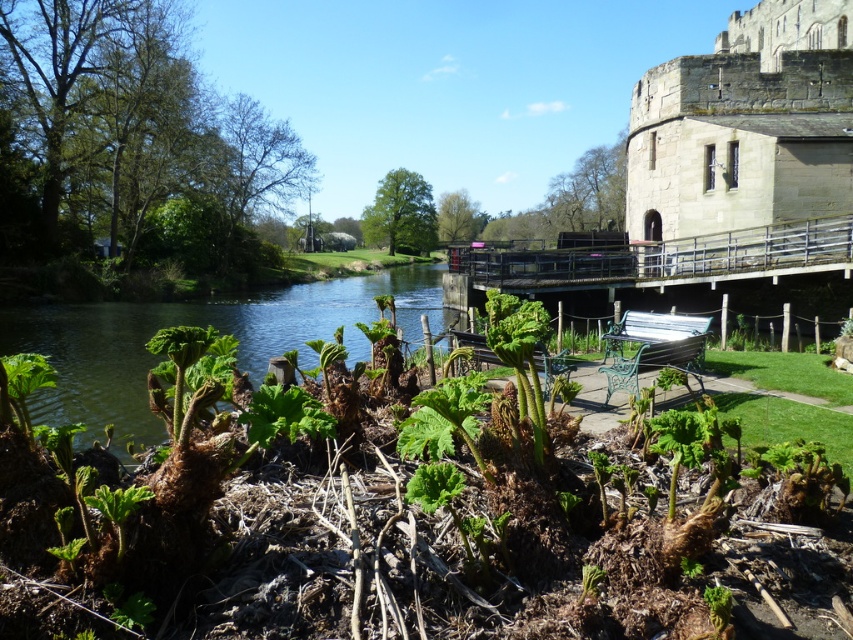
Question: Is gray stone castle at upper right in front of green leafy plants at center?

Choices:
 (A) yes
 (B) no

Answer: (B)

Question: Can you confirm if gray stone castle at upper right is smaller than green leafy plants at center?

Choices:
 (A) yes
 (B) no

Answer: (B)

Question: Among these points, which one is farthest from the camera?

Choices:
 (A) (132, 330)
 (B) (813, 29)

Answer: (B)

Question: Is gray stone castle at upper right to the right of green leafy plants at center from the viewer's perspective?

Choices:
 (A) no
 (B) yes

Answer: (B)